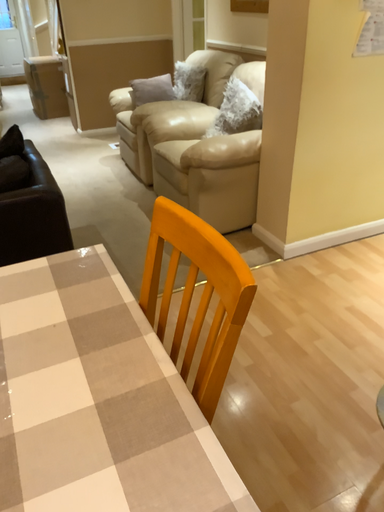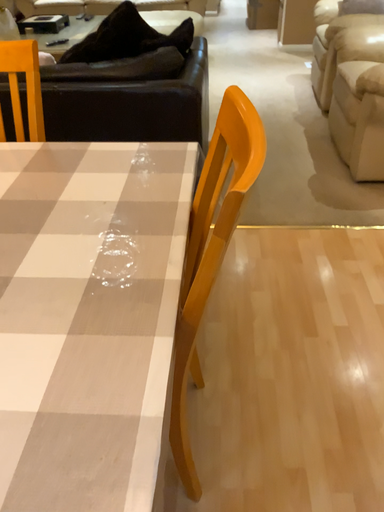
Question: Which way did the camera rotate in the video?

Choices:
 (A) rotated left
 (B) rotated right

Answer: (A)